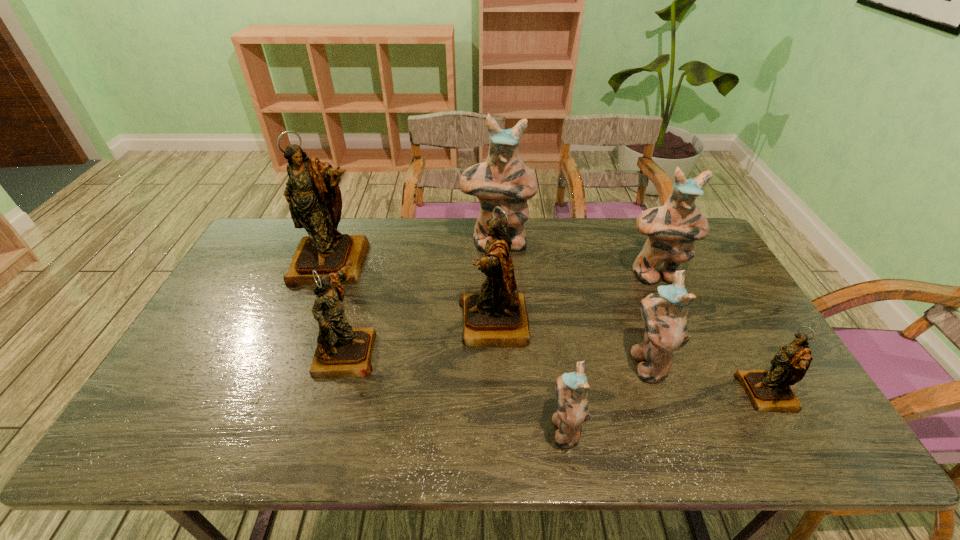
Where is `pink figurine identified as the second closest to the third smallest gold figurine`? Image resolution: width=960 pixels, height=540 pixels. pink figurine identified as the second closest to the third smallest gold figurine is located at coordinates (504, 180).

Identify which pink figurine is the second closest to the biggest pink figurine. Please provide its 2D coordinates. Your answer should be formatted as a tuple, i.e. [(x, y)], where the tuple contains the x and y coordinates of a point satisfying the conditions above.

[(664, 314)]

Where is `gold figurine that is the second nearest to the nearest pink figurine`? This screenshot has width=960, height=540. gold figurine that is the second nearest to the nearest pink figurine is located at coordinates (769, 390).

The width and height of the screenshot is (960, 540). Identify the location of gold figurine object that ranks as the third closest to the third smallest pink figurine. (341, 351).

Where is `free space that satisfies the following two spatial constraints: 1. on the front-facing side of the second farthest pink figurine; 2. on the front-facing side of the third smallest gold figurine`? free space that satisfies the following two spatial constraints: 1. on the front-facing side of the second farthest pink figurine; 2. on the front-facing side of the third smallest gold figurine is located at coordinates (677, 323).